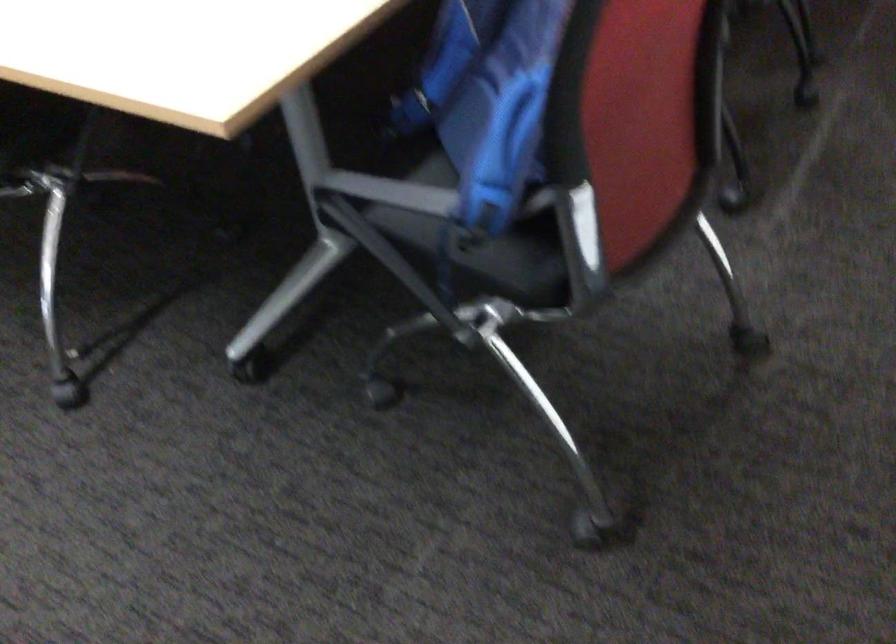
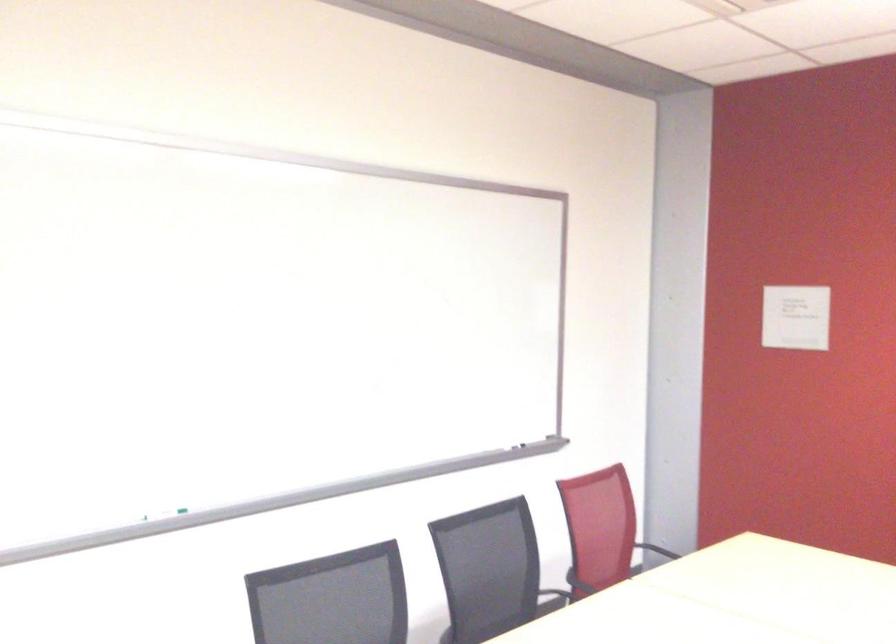
The images are taken continuously from a first-person perspective. In which direction is your viewpoint rotating?

The camera's rotation is toward left-up.